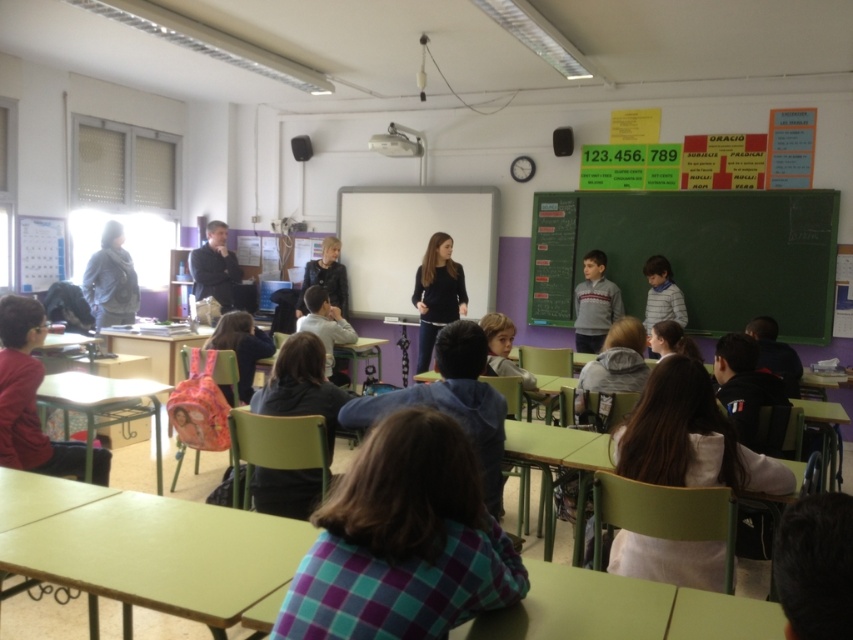
Can you confirm if gray fleece sweater at center is positioned to the left of dark blue suit at center?

No, gray fleece sweater at center is not to the left of dark blue suit at center.

Which of these two, gray fleece sweater at center or dark blue suit at center, stands taller?

Standing taller between the two is gray fleece sweater at center.

Where is `gray fleece sweater at center`? The width and height of the screenshot is (853, 640). gray fleece sweater at center is located at coordinates (595, 304).

In order to click on gray fleece sweater at center in this screenshot , I will do `click(595, 304)`.

Does plaid shirt at center have a greater width compared to striped cotton shirt at center?

Yes.

Does plaid shirt at center have a larger size compared to striped cotton shirt at center?

Incorrect, plaid shirt at center is not larger than striped cotton shirt at center.

Image resolution: width=853 pixels, height=640 pixels. Identify the location of plaid shirt at center. (402, 541).

Is matte plastic table at lower left thinner than green plastic table at lower right?

No.

Who is more distant from viewer, (73, 404) or (793, 403)?

Positioned behind is point (793, 403).

The image size is (853, 640). Find the location of `matte plastic table at lower left`. matte plastic table at lower left is located at coordinates (103, 404).